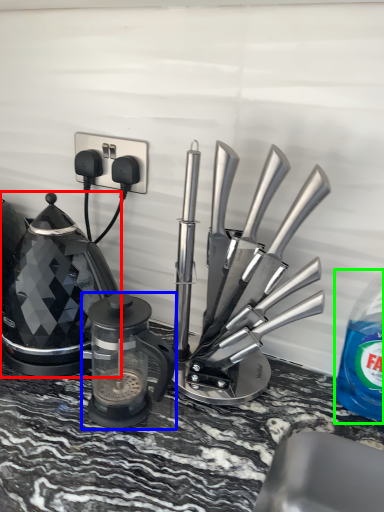
Question: Based on their relative distances, which object is farther from kettle (highlighted by a red box)? Choose from kitchen appliance (highlighted by a blue box) and bottle (highlighted by a green box).

Choices:
 (A) kitchen appliance
 (B) bottle

Answer: (B)